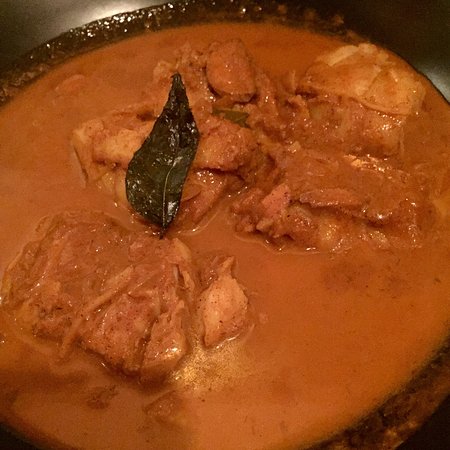
Locate an element on the screen. This screenshot has width=450, height=450. upper right rim of bowl is located at coordinates [x=418, y=64].